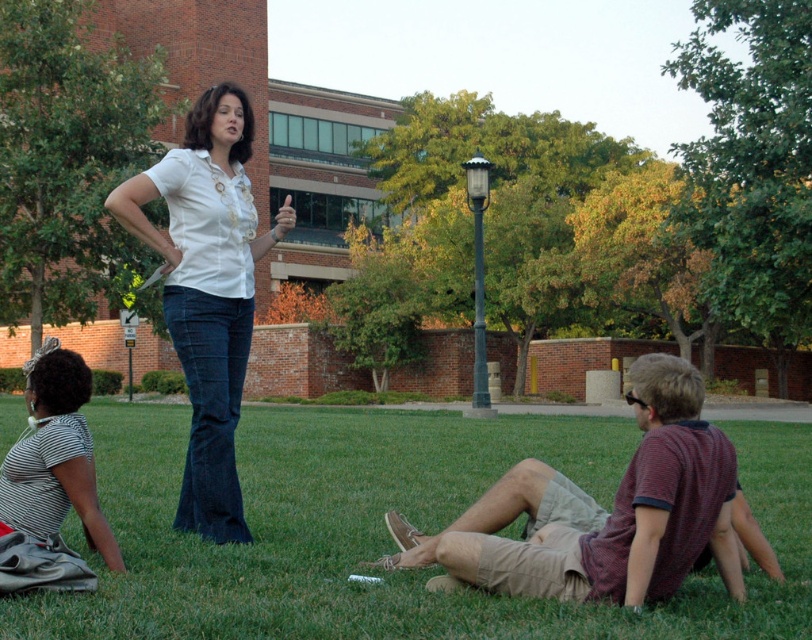
Question: Does striped cotton shirt at lower right appear on the left side of striped fabric shirt at lower left?

Choices:
 (A) yes
 (B) no

Answer: (B)

Question: Which point is closer to the camera taking this photo?

Choices:
 (A) (115, 548)
 (B) (670, 376)
 (C) (191, 266)
 (D) (149, 499)

Answer: (B)

Question: Which of these objects is positioned closest to the striped fabric shirt at lower left?

Choices:
 (A) striped cotton shirt at lower right
 (B) green grass at lower center

Answer: (A)

Question: Which point is closer to the camera?

Choices:
 (A) (262, 486)
 (B) (81, 483)
 (C) (249, 221)
 (D) (690, 499)

Answer: (D)

Question: Does striped cotton shirt at lower right have a larger size compared to white matte shirt at center?

Choices:
 (A) no
 (B) yes

Answer: (B)

Question: Can you confirm if striped cotton shirt at lower right is thinner than white matte shirt at center?

Choices:
 (A) yes
 (B) no

Answer: (B)